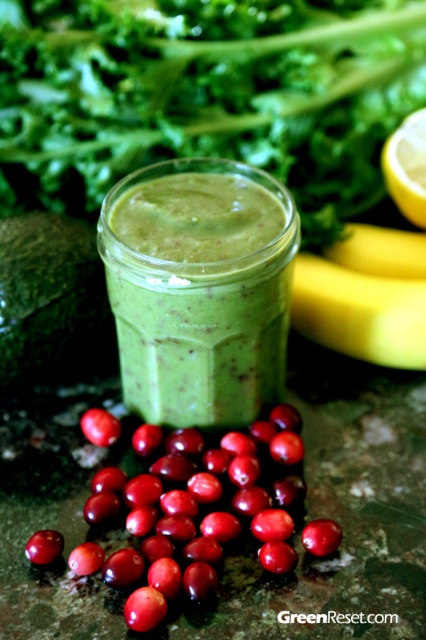
What do you see at coordinates (199, 289) in the screenshot? The image size is (426, 640). I see `green matte smoothie at center` at bounding box center [199, 289].

Is green matte smoothie at center above shiny red berry at center?

Yes.

Where is `green matte smoothie at center`? The height and width of the screenshot is (640, 426). green matte smoothie at center is located at coordinates pos(199,289).

Identify the location of green matte smoothie at center. The image size is (426, 640). (199, 289).

Who is lower down, yellow matte lemon at upper right or shiny red berry at lower left?

shiny red berry at lower left is lower down.

Which is above, yellow matte lemon at upper right or shiny red berry at lower left?

yellow matte lemon at upper right is above.

Who is more distant from viewer, [420,154] or [104,442]?

The point [420,154] is more distant.

The height and width of the screenshot is (640, 426). Find the location of `yellow matte lemon at upper right`. yellow matte lemon at upper right is located at coordinates (406, 166).

Is shiny red berries at lower left smaller than yellow matte lemon at upper right?

Actually, shiny red berries at lower left might be larger than yellow matte lemon at upper right.

Does point (276, 563) come farther from viewer compared to point (423, 189)?

No.

Where is `shiny red berries at lower left`? The image size is (426, 640). shiny red berries at lower left is located at coordinates (195, 509).